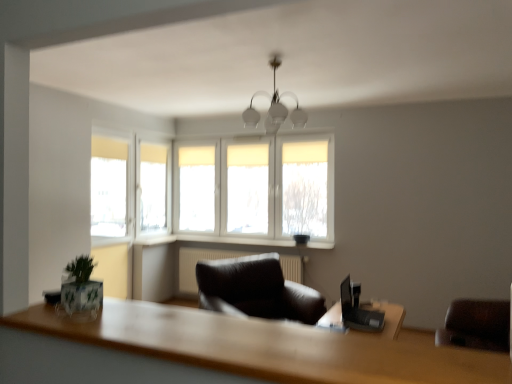
Find the location of a particular element. This screenshot has height=384, width=512. black plastic laptop at right is located at coordinates (358, 311).

Identify the location of white plastic window sill at center, placed as the first window sill when sorted from left to right. The height and width of the screenshot is (384, 512). (155, 240).

The image size is (512, 384). What do you see at coordinates (80, 291) in the screenshot?
I see `green matte plant at lower left` at bounding box center [80, 291].

This screenshot has height=384, width=512. What do you see at coordinates (265, 347) in the screenshot?
I see `wooden table at lower center` at bounding box center [265, 347].

Locate an element on the screen. black plastic laptop at right is located at coordinates (358, 311).

From the image's perspective, is white plastic window sill at center, placed as the second window sill when sorted from left to right, located above white fabric window at center?

No, from the image's perspective, white plastic window sill at center, placed as the second window sill when sorted from left to right, is not above white fabric window at center.

Is white plastic window sill at center, the first window sill when ordered from right to left, facing away from white fabric window at center?

No, white fabric window at center is not at the back of white plastic window sill at center, the first window sill when ordered from right to left.

Between white plastic window sill at center, the first window sill when ordered from right to left, and white fabric window at center, which one appears on the right side from the viewer's perspective?

Positioned to the right is white plastic window sill at center, the first window sill when ordered from right to left.

Is green matte plant at lower left at the back of white plastic window sill at center, which is the second window sill from right to left?

No.

Does white plastic window sill at center, placed as the first window sill when sorted from left to right, have a greater width compared to green matte plant at lower left?

Indeed, white plastic window sill at center, placed as the first window sill when sorted from left to right, has a greater width compared to green matte plant at lower left.

Which is more to the left, white plastic window sill at center, placed as the first window sill when sorted from left to right, or green matte plant at lower left?

white plastic window sill at center, placed as the first window sill when sorted from left to right.

From the image's perspective, relative to green matte plant at lower left, is white plastic window sill at center, which is the second window sill from right to left, above or below?

white plastic window sill at center, which is the second window sill from right to left, is below green matte plant at lower left.

Considering the relative sizes of green matte plant at lower left and white plastic window sill at center, the first window sill when ordered from right to left, in the image provided, is green matte plant at lower left bigger than white plastic window sill at center, the first window sill when ordered from right to left,?

Actually, green matte plant at lower left might be smaller than white plastic window sill at center, the first window sill when ordered from right to left.

Identify the location of plant that is above the white plastic window sill at center, the first window sill when ordered from right to left (from a real-world perspective). (80, 291).

Is green matte plant at lower left turned away from white plastic window sill at center, placed as the second window sill when sorted from left to right?

green matte plant at lower left does not have its back to white plastic window sill at center, placed as the second window sill when sorted from left to right.

Is white frosted glass chandelier at center positioned beyond the bounds of black plastic laptop at right?

white frosted glass chandelier at center is positioned outside black plastic laptop at right.

Is white frosted glass chandelier at center behind black plastic laptop at right?

Yes, white frosted glass chandelier at center is further from the camera.

Is white frosted glass chandelier at center to the left of black plastic laptop at right from the viewer's perspective?

Indeed, white frosted glass chandelier at center is positioned on the left side of black plastic laptop at right.

Which of these two, white frosted glass chandelier at center or black plastic laptop at right, is wider?

With larger width is white frosted glass chandelier at center.

Is there a large distance between white plastic window sill at center, the first window sill when ordered from right to left, and white plastic window sill at center, placed as the first window sill when sorted from left to right?

That's not correct — white plastic window sill at center, the first window sill when ordered from right to left, is a little close to white plastic window sill at center, placed as the first window sill when sorted from left to right.

Does point (236, 239) come closer to viewer compared to point (144, 241)?

That is True.

Is white plastic window sill at center, the first window sill when ordered from right to left, oriented away from white plastic window sill at center, placed as the first window sill when sorted from left to right?

No, white plastic window sill at center, placed as the first window sill when sorted from left to right, is not at the back of white plastic window sill at center, the first window sill when ordered from right to left.

From a real-world perspective, is black plastic laptop at right on top of wooden table at lower center?

No.

Considering the sizes of objects black plastic laptop at right and wooden table at lower center in the image provided, who is wider, black plastic laptop at right or wooden table at lower center?

Wider between the two is wooden table at lower center.

Which is more to the right, black plastic laptop at right or wooden table at lower center?

black plastic laptop at right.

Is black plastic laptop at right positioned behind wooden table at lower center?

That is True.

Based on the photo, is white plastic window sill at center, which is the second window sill from right to left, touching white fabric window at center?

No.

Identify the location of window sill on the left of white fabric window at center. The image size is (512, 384). (155, 240).

From a real-world perspective, relative to white fabric window at center, is white plastic window sill at center, placed as the first window sill when sorted from left to right, vertically above or below?

From a real-world perspective, white plastic window sill at center, placed as the first window sill when sorted from left to right, is physically below white fabric window at center.

Can you confirm if white plastic window sill at center, which is the second window sill from right to left, is wider than white fabric window at center?

Yes, white plastic window sill at center, which is the second window sill from right to left, is wider than white fabric window at center.

Locate an element on the screen. This screenshot has width=512, height=384. window behind the white plastic window sill at center, the first window sill when ordered from right to left is located at coordinates (220, 190).

Find the location of a particular element. Image resolution: width=512 pixels, height=384 pixels. plant on the right of white plastic window sill at center, placed as the first window sill when sorted from left to right is located at coordinates (80, 291).

Considering their positions, is white frosted glass chandelier at center positioned further to white plastic window sill at center, placed as the second window sill when sorted from left to right, than white fabric window at center?

white frosted glass chandelier at center is further to white plastic window sill at center, placed as the second window sill when sorted from left to right.

When comparing their distances from black plastic laptop at right, does white frosted glass chandelier at center or white fabric window at center seem further?

Based on the image, white frosted glass chandelier at center appears to be further to black plastic laptop at right.

Based on the photo, which object lies nearer to the anchor point white plastic window sill at center, the first window sill when ordered from right to left, black plastic laptop at right or green matte plant at lower left?

black plastic laptop at right.

When comparing their distances from white plastic window sill at center, the first window sill when ordered from right to left, does white fabric window at center or green matte plant at lower left seem closer?

white fabric window at center lies closer to white plastic window sill at center, the first window sill when ordered from right to left, than the other object.

Which object lies nearer to the anchor point white frosted glass chandelier at center, black plastic laptop at right or white fabric window at center?

The object closer to white frosted glass chandelier at center is white fabric window at center.

Considering their positions, is white frosted glass chandelier at center positioned further to white plastic window sill at center, the first window sill when ordered from right to left, than white plastic window sill at center, placed as the first window sill when sorted from left to right?

The object further to white plastic window sill at center, the first window sill when ordered from right to left, is white frosted glass chandelier at center.

Which object lies further to the anchor point white frosted glass chandelier at center, green matte plant at lower left or white fabric window at center?

Among the two, green matte plant at lower left is located further to white frosted glass chandelier at center.

When comparing their distances from white plastic window sill at center, placed as the second window sill when sorted from left to right, does green matte plant at lower left or wooden table at lower center seem closer?

green matte plant at lower left is closer to white plastic window sill at center, placed as the second window sill when sorted from left to right.

The image size is (512, 384). What are the coordinates of `window sill between green matte plant at lower left and white plastic window sill at center, which is the second window sill from right to left, from front to back` in the screenshot? It's located at (234, 241).

Where is `lamp between wooden table at lower center and white plastic window sill at center, placed as the first window sill when sorted from left to right, from front to back`? lamp between wooden table at lower center and white plastic window sill at center, placed as the first window sill when sorted from left to right, from front to back is located at coordinates (275, 106).

In order to click on computer desk between wooden table at lower center and white plastic window sill at center, placed as the first window sill when sorted from left to right, from front to back in this screenshot , I will do `click(358, 311)`.

Identify the location of plant positioned between wooden table at lower center and white plastic window sill at center, which is the second window sill from right to left, from near to far. Image resolution: width=512 pixels, height=384 pixels. (80, 291).